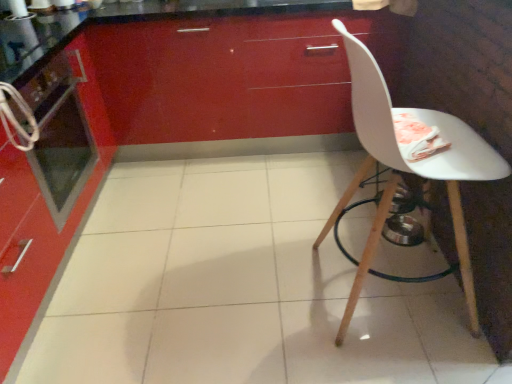
Question: Is metallic oven at left positioned in front of white matte chair at right?

Choices:
 (A) no
 (B) yes

Answer: (A)

Question: Would you say metallic oven at left contains white matte chair at right?

Choices:
 (A) no
 (B) yes

Answer: (A)

Question: Is metallic oven at left facing towards white matte chair at right?

Choices:
 (A) yes
 (B) no

Answer: (A)

Question: From the image's perspective, is metallic oven at left above white matte chair at right?

Choices:
 (A) yes
 (B) no

Answer: (A)

Question: Considering the relative sizes of metallic oven at left and white matte chair at right in the image provided, is metallic oven at left bigger than white matte chair at right?

Choices:
 (A) no
 (B) yes

Answer: (A)

Question: Is metallic oven at left smaller than white matte chair at right?

Choices:
 (A) no
 (B) yes

Answer: (B)

Question: Can you confirm if metallic oven at left is shorter than glossy red cabinet at upper center?

Choices:
 (A) yes
 (B) no

Answer: (A)

Question: Is metallic oven at left positioned before glossy red cabinet at upper center?

Choices:
 (A) no
 (B) yes

Answer: (B)

Question: Considering the relative sizes of metallic oven at left and glossy red cabinet at upper center in the image provided, is metallic oven at left smaller than glossy red cabinet at upper center?

Choices:
 (A) no
 (B) yes

Answer: (B)

Question: From the image's perspective, does metallic oven at left appear higher than glossy red cabinet at upper center?

Choices:
 (A) no
 (B) yes

Answer: (A)

Question: Is metallic oven at left positioned with its back to glossy red cabinet at upper center?

Choices:
 (A) yes
 (B) no

Answer: (B)

Question: Is the depth of metallic oven at left greater than that of glossy red cabinet at upper center?

Choices:
 (A) yes
 (B) no

Answer: (B)

Question: From a real-world perspective, is glossy red cabinet at upper center physically below metallic oven at left?

Choices:
 (A) yes
 (B) no

Answer: (A)